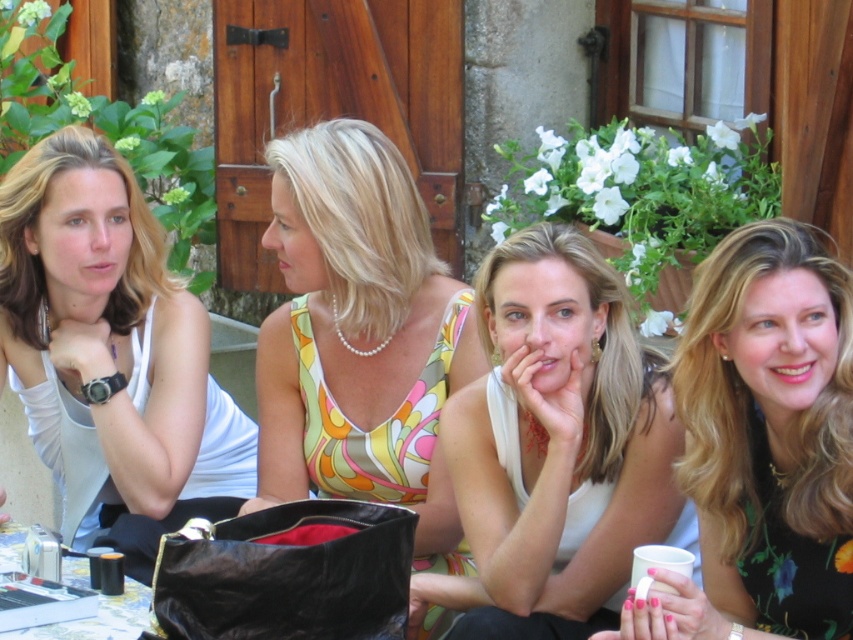
Is white matte tank top at center thinner than black glossy cup at lower left?

No.

Locate an element on the screen. white matte tank top at center is located at coordinates (556, 448).

Between point (692, 563) and point (103, 566), which one is positioned in front?

Point (692, 563)

Looking at this image, is white ceramic cup at lower right taller than metallic silver cup at lower left?

No.

What do you see at coordinates (657, 566) in the screenshot?
I see `white ceramic cup at lower right` at bounding box center [657, 566].

Where is `white ceramic cup at lower right`? The height and width of the screenshot is (640, 853). white ceramic cup at lower right is located at coordinates (657, 566).

In the scene shown: Is black glossy cup at lower left wider than white ceramic cup at lower right?

Correct, the width of black glossy cup at lower left exceeds that of white ceramic cup at lower right.

Who is taller, black glossy cup at lower left or white ceramic cup at lower right?

With more height is black glossy cup at lower left.

Does point (107, 627) come closer to viewer compared to point (648, 580)?

That is False.

You are a GUI agent. You are given a task and a screenshot of the screen. Output one action in this format:
    pyautogui.click(x=<x>, y=<y>)
    Task: Click on the black glossy cup at lower left
    The image size is (853, 640).
    Given the screenshot: What is the action you would take?
    pyautogui.click(x=99, y=618)